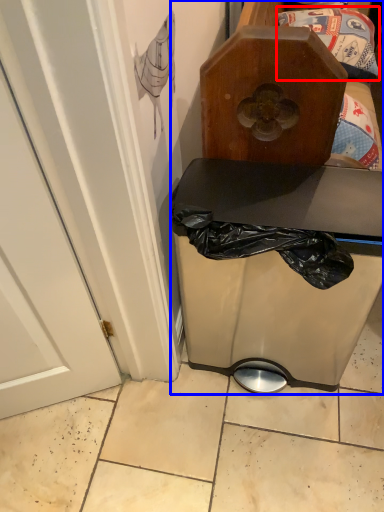
Question: Among these objects, which one is farthest to the camera, waste (highlighted by a red box) or furniture (highlighted by a blue box)?

Choices:
 (A) waste
 (B) furniture

Answer: (A)